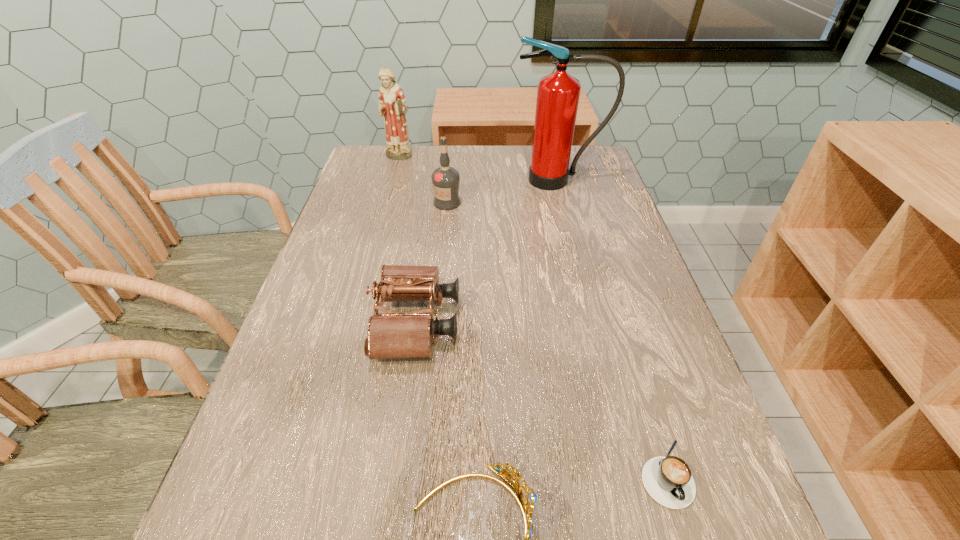
You are a GUI agent. You are given a task and a screenshot of the screen. Output one action in this format:
    pyautogui.click(x=<x>, y=<y>)
    Task: Click on the free space between the binoculars and the farthest object
    
    Given the screenshot: What is the action you would take?
    pyautogui.click(x=407, y=241)

This screenshot has height=540, width=960. Identify the location of vacant space in between the fourth farthest object and the fifth shortest object. (407, 241).

In order to click on free space between the second farthest object and the cappuccino in this screenshot , I will do `click(612, 327)`.

Choose which object is the nearest neighbor to the third nearest object. Please provide its 2D coordinates. Your answer should be formatted as a tuple, i.e. [(x, y)], where the tuple contains the x and y coordinates of a point satisfying the conditions above.

[(528, 498)]

Select which object is the second closest to the tiara. Please provide its 2D coordinates. Your answer should be formatted as a tuple, i.e. [(x, y)], where the tuple contains the x and y coordinates of a point satisfying the conditions above.

[(394, 334)]

Where is `vacant space that satisfies the following two spatial constraints: 1. on the front label of the vodka; 2. through the eyepieces of the fourth farthest object`? vacant space that satisfies the following two spatial constraints: 1. on the front label of the vodka; 2. through the eyepieces of the fourth farthest object is located at coordinates (436, 323).

Locate an element on the screen. vacant space that satisfies the following two spatial constraints: 1. on the front-facing side of the fire extinguisher; 2. on the left side of the farthest object is located at coordinates (392, 180).

Where is `free space in the image that satisfies the following two spatial constraints: 1. on the front label of the vodka; 2. through the eyepieces of the binoculars`? This screenshot has width=960, height=540. free space in the image that satisfies the following two spatial constraints: 1. on the front label of the vodka; 2. through the eyepieces of the binoculars is located at coordinates (436, 323).